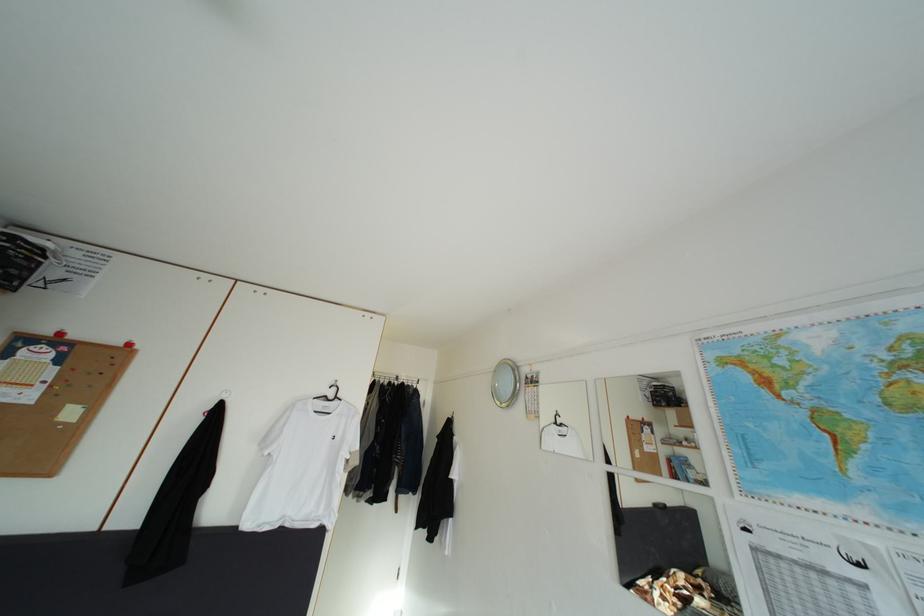
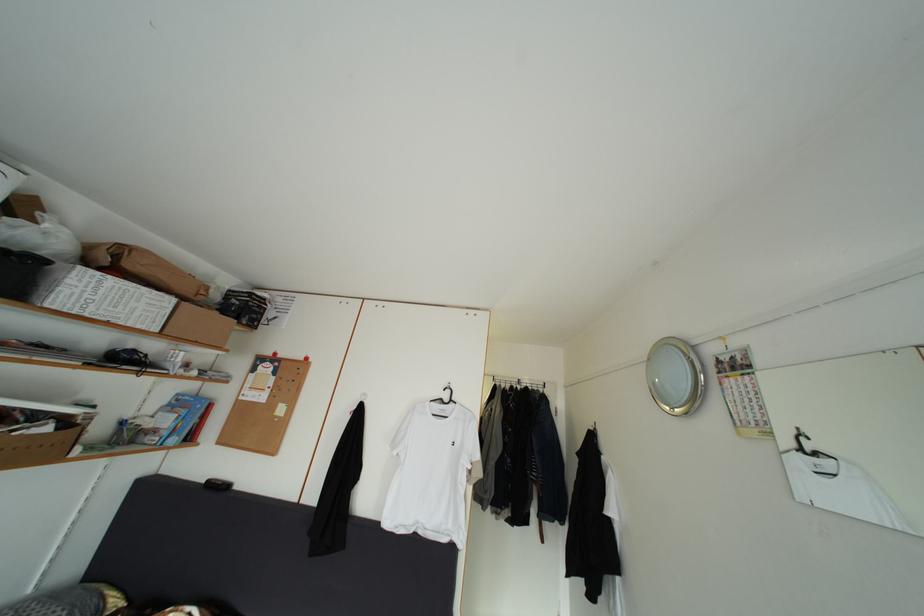
Question: What movement of the cameraman would produce the second image?

Choices:
 (A) Left
 (B) Right
 (C) Forward
 (D) Backward

Answer: (C)